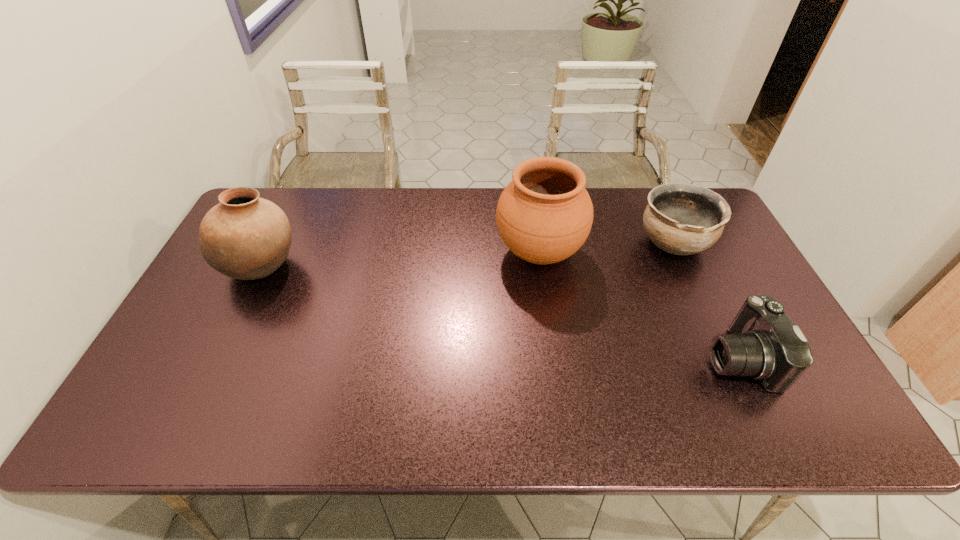
This screenshot has width=960, height=540. Identify the location of the second object from left to right. (544, 215).

At what (x,y) coordinates should I click in order to perform the action: click on the leftmost object. Please return your answer as a coordinate pair (x, y). Looking at the image, I should click on (245, 237).

In order to click on the rightmost pottery in this screenshot , I will do `click(682, 219)`.

Find the location of a particular element. camera is located at coordinates (764, 343).

At what (x,y) coordinates should I click in order to perform the action: click on free region located on the right of the second pottery from right to left. Please return your answer as a coordinate pair (x, y). Looking at the image, I should click on (679, 253).

Find the location of a particular element. This screenshot has width=960, height=540. vacant space located 0.200m on the front of the leftmost pottery is located at coordinates (219, 356).

Find the location of a particular element. This screenshot has height=540, width=960. vacant area located on the front of the shortest pottery is located at coordinates (707, 316).

Where is `vacant space located on the lens of the camera`? The image size is (960, 540). vacant space located on the lens of the camera is located at coordinates click(547, 357).

Image resolution: width=960 pixels, height=540 pixels. Find the location of `vacant region located 0.300m on the lens of the camera`. vacant region located 0.300m on the lens of the camera is located at coordinates (584, 357).

Where is `free location located 0.250m on the lens of the camera`? This screenshot has width=960, height=540. free location located 0.250m on the lens of the camera is located at coordinates (605, 357).